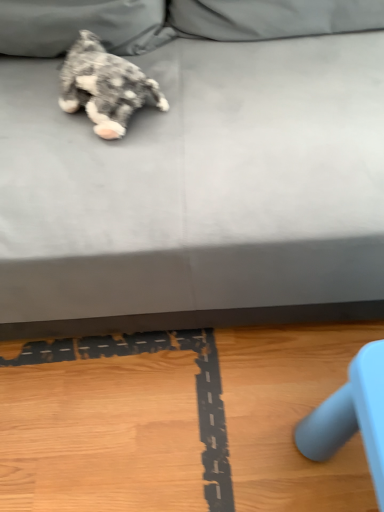
What do you see at coordinates (105, 86) in the screenshot? The width and height of the screenshot is (384, 512). I see `fluffy gray dog at upper left` at bounding box center [105, 86].

I want to click on fluffy gray dog at upper left, so click(x=105, y=86).

The image size is (384, 512). In order to click on gray fabric couch at upper center in this screenshot , I will do `click(199, 173)`.

This screenshot has width=384, height=512. Describe the element at coordinates (199, 173) in the screenshot. I see `gray fabric couch at upper center` at that location.

At what (x,y) coordinates should I click in order to perform the action: click on fluffy gray dog at upper left. Please return your answer as a coordinate pair (x, y). Looking at the image, I should click on [x=105, y=86].

Can you confirm if gray fabric couch at upper center is positioned to the right of fluffy gray dog at upper left?

Yes.

Is the position of gray fabric couch at upper center less distant than that of fluffy gray dog at upper left?

Yes, gray fabric couch at upper center is closer to the camera.

Is point (185, 261) positioned before point (120, 96)?

Yes, point (185, 261) is in front of point (120, 96).

From the image's perspective, does gray fabric couch at upper center appear lower than fluffy gray dog at upper left?

Incorrect, from the image's perspective, gray fabric couch at upper center is higher than fluffy gray dog at upper left.

From a real-world perspective, is gray fabric couch at upper center positioned above or below fluffy gray dog at upper left?

gray fabric couch at upper center is below fluffy gray dog at upper left.

Which object is wider, gray fabric couch at upper center or fluffy gray dog at upper left?

With larger width is gray fabric couch at upper center.

Considering the relative sizes of gray fabric couch at upper center and fluffy gray dog at upper left in the image provided, is gray fabric couch at upper center taller than fluffy gray dog at upper left?

Correct, gray fabric couch at upper center is much taller as fluffy gray dog at upper left.

Is gray fabric couch at upper center bigger or smaller than fluffy gray dog at upper left?

In the image, gray fabric couch at upper center appears to be larger than fluffy gray dog at upper left.

Is fluffy gray dog at upper left a part of gray fabric couch at upper center?

Yes, gray fabric couch at upper center contains fluffy gray dog at upper left.

Is gray fabric couch at upper center not near fluffy gray dog at upper left?

gray fabric couch at upper center is actually quite close to fluffy gray dog at upper left.

From the picture: Is gray fabric couch at upper center aimed at fluffy gray dog at upper left?

Yes, gray fabric couch at upper center is facing fluffy gray dog at upper left.

This screenshot has height=512, width=384. In order to click on dog below the gray fabric couch at upper center (from the image's perspective) in this screenshot , I will do `click(105, 86)`.

Visually, is fluffy gray dog at upper left positioned to the left or to the right of gray fabric couch at upper center?

fluffy gray dog at upper left is positioned on gray fabric couch at upper center's left side.

Is fluffy gray dog at upper left closer to the viewer compared to gray fabric couch at upper center?

No, it is not.

Which point is more forward, (x=104, y=130) or (x=94, y=176)?

Positioned in front is point (x=94, y=176).

From the image's perspective, is fluffy gray dog at upper left below gray fabric couch at upper center?

Indeed, from the image's perspective, fluffy gray dog at upper left is shown beneath gray fabric couch at upper center.

Consider the image. From a real-world perspective, relative to gray fabric couch at upper center, is fluffy gray dog at upper left vertically above or below?

fluffy gray dog at upper left is situated higher than gray fabric couch at upper center in the real world.

Considering the relative sizes of fluffy gray dog at upper left and gray fabric couch at upper center in the image provided, is fluffy gray dog at upper left thinner than gray fabric couch at upper center?

Yes, fluffy gray dog at upper left is thinner than gray fabric couch at upper center.

Is fluffy gray dog at upper left taller or shorter than gray fabric couch at upper center?

Considering their sizes, fluffy gray dog at upper left has less height than gray fabric couch at upper center.

Who is smaller, fluffy gray dog at upper left or gray fabric couch at upper center?

fluffy gray dog at upper left.

Which is correct: fluffy gray dog at upper left is inside gray fabric couch at upper center, or outside of it?

fluffy gray dog at upper left is contained in gray fabric couch at upper center.

Is fluffy gray dog at upper left far from gray fabric couch at upper center?

No, fluffy gray dog at upper left is not far from gray fabric couch at upper center.

Is fluffy gray dog at upper left looking in the opposite direction of gray fabric couch at upper center?

Yes, fluffy gray dog at upper left's orientation is away from gray fabric couch at upper center.

This screenshot has width=384, height=512. I want to click on studio couch in front of the fluffy gray dog at upper left, so click(x=199, y=173).

Locate an element on the screen. This screenshot has height=512, width=384. dog to the left of gray fabric couch at upper center is located at coordinates 105,86.

There is a gray fabric couch at upper center. What are the coordinates of `dog above it (from a real-world perspective)` in the screenshot? It's located at (105, 86).